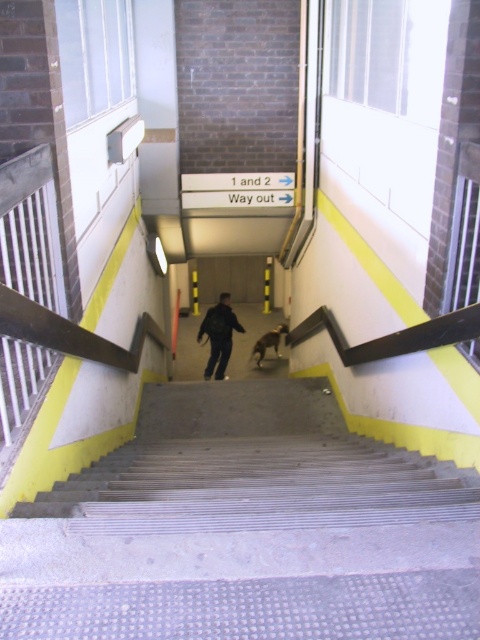
Looking at this image, you are standing at the top of the metallic gray stairs at center and want to reach the black matte jacket at center. Which direction should you move to get closer to the jacket?

Since the metallic gray stairs at center are closer to you than the black matte jacket at center, you should move downward along the stairs towards the jacket to get closer.

You are standing on the metallic gray stairs at center and need to place a small package on the black matte jacket at center. Can you reach the jacket without moving from your current position?

The metallic gray stairs at center is positioned on the right side of the black matte jacket at center, so you can reach the jacket by extending your arm to the left side of the stairs.

You are standing at the top of the metallic gray stairs at center. You need to reach the hallway below. According to the signs, which direction should you turn to follow the path indicated by the arrows on the signs?

The signs at the top of the metallic gray stairs at center point to the right, so you should turn right to follow the path indicated by the arrows on the signs.